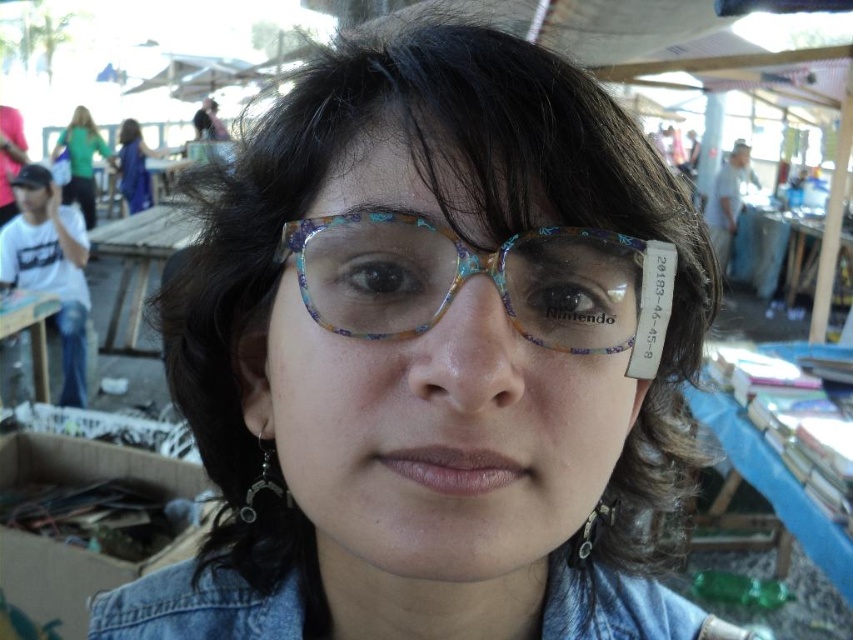
From the picture: Does translucent plastic glasses at center appear on the left side of white t-shirt at left?

In fact, translucent plastic glasses at center is to the right of white t-shirt at left.

Can you confirm if translucent plastic glasses at center is thinner than white t-shirt at left?

Yes.

Between point (509, 320) and point (12, 280), which one is positioned in front?

Positioned in front is point (509, 320).

Where is `translucent plastic glasses at center`? This screenshot has width=853, height=640. translucent plastic glasses at center is located at coordinates (489, 276).

In the scene shown: Is dark brown glossy hair at center in front of white paper at upper right?

Yes.

Can you confirm if dark brown glossy hair at center is wider than white paper at upper right?

Incorrect, dark brown glossy hair at center's width does not surpass white paper at upper right's.

Does point (442, 212) come behind point (726, 182)?

No, it is not.

Image resolution: width=853 pixels, height=640 pixels. I want to click on dark brown glossy hair at center, so click(451, 228).

Can you confirm if faded denim jacket at lower right is bigger than green fabric shirt at upper left?

No, faded denim jacket at lower right is not bigger than green fabric shirt at upper left.

Between faded denim jacket at lower right and green fabric shirt at upper left, which one appears on the left side from the viewer's perspective?

green fabric shirt at upper left

Between point (682, 634) and point (86, 156), which one is positioned behind?

The point (86, 156) is more distant.

Identify the location of faded denim jacket at lower right. The width and height of the screenshot is (853, 640). (196, 608).